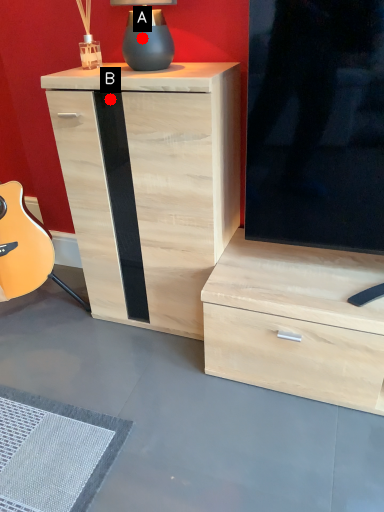
Question: Two points are circled on the image, labeled by A and B beside each circle. Which point is further to the camera?

Choices:
 (A) A is further
 (B) B is further

Answer: (B)